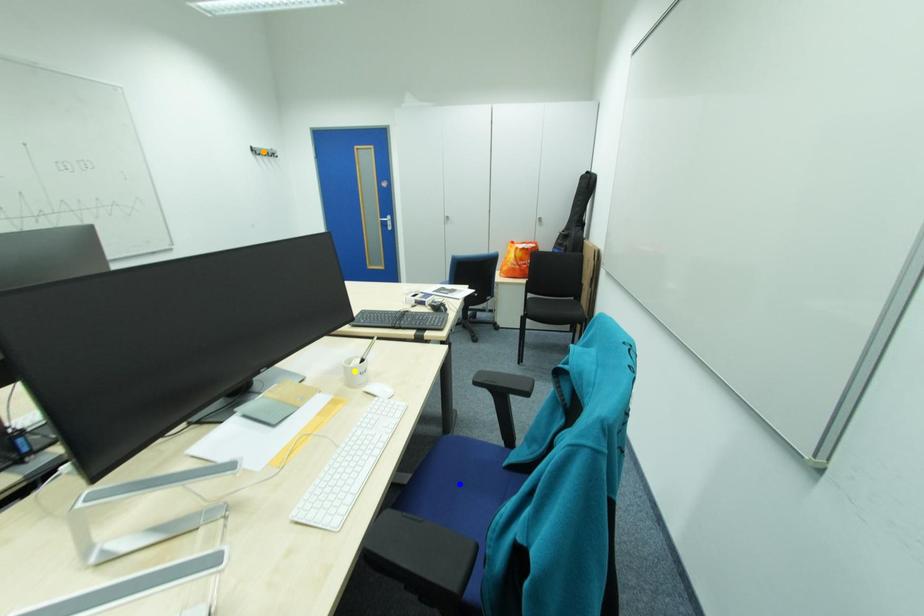
Order these from nearest to farthest:
A) orange point
B) yellow point
C) blue point

orange point < blue point < yellow point